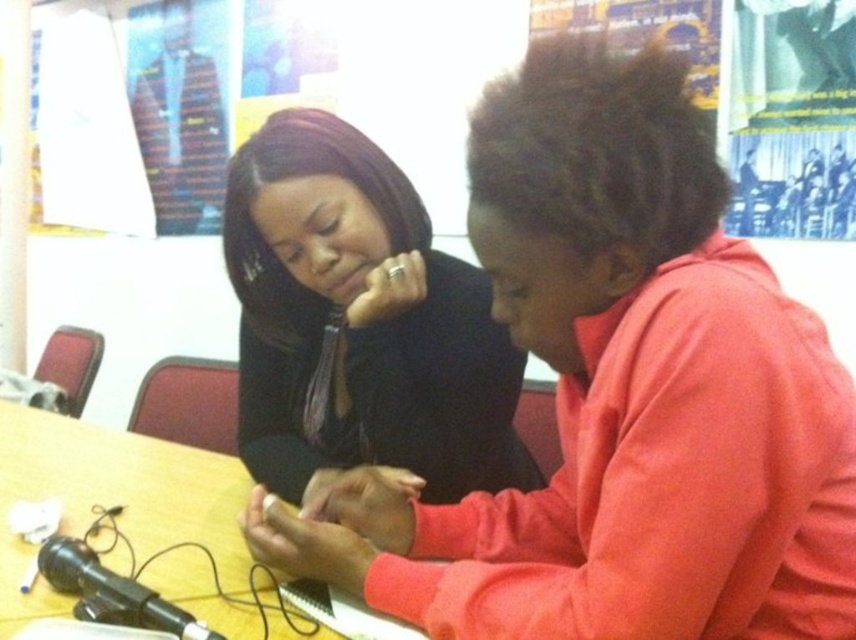
Question: Does matte black shirt at center come behind black satin blouse at center?

Choices:
 (A) yes
 (B) no

Answer: (B)

Question: Which object is positioned farthest from the wooden table at center?

Choices:
 (A) black satin blouse at center
 (B) matte black shirt at center

Answer: (B)

Question: Which of the following is the farthest from the observer?

Choices:
 (A) wooden table at center
 (B) matte black shirt at center
 (C) black satin blouse at center

Answer: (C)

Question: Where is matte black shirt at center located in relation to wooden table at center in the image?

Choices:
 (A) above
 (B) below

Answer: (A)

Question: Is matte black shirt at center to the right of wooden table at center from the viewer's perspective?

Choices:
 (A) no
 (B) yes

Answer: (B)

Question: Which object is farther from the camera taking this photo?

Choices:
 (A) matte black shirt at center
 (B) wooden table at center
 (C) black satin blouse at center

Answer: (C)